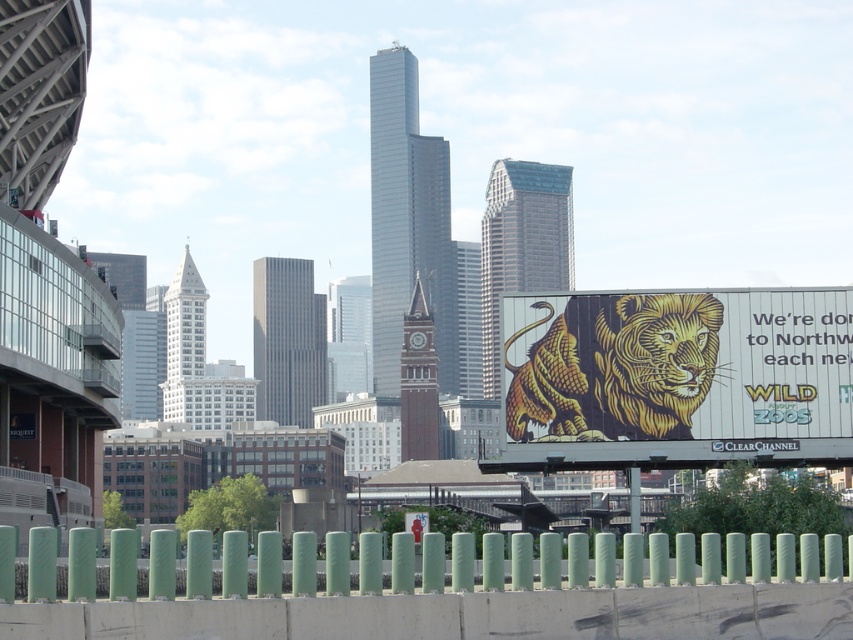
You are standing at the camera position and want to reach the point marked at coordinates point (723,428). Given that you can walk 100 feet per minute, how many minutes will it take you to reach that point?

The point marked at coordinates point (723,428) is 329.60 feet away from the camera. At a walking speed of 100 feet per minute, it will take approximately 3.296 minutes to reach the point. Since you can walk 100 feet per minute, you would need about 3.3 minutes to cover the distance.